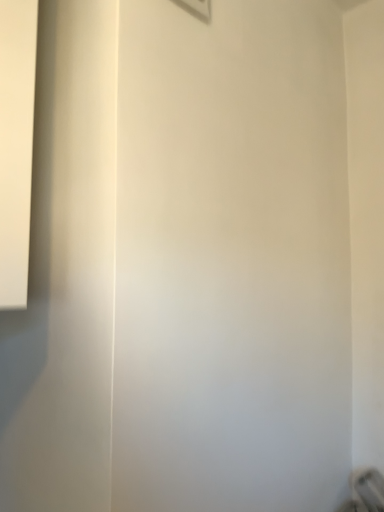
Question: Should I look upward or downward to see matte plastic light switch at upper center?

Choices:
 (A) down
 (B) up

Answer: (B)